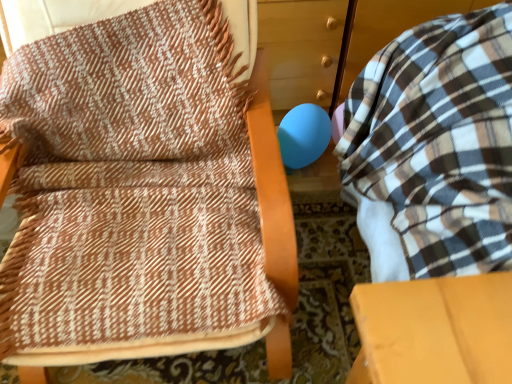
Question: Can you confirm if brown woven blanket at upper left is thinner than plaid fabric bean bag at right?

Choices:
 (A) no
 (B) yes

Answer: (B)

Question: Is brown woven blanket at upper left in contact with plaid fabric bean bag at right?

Choices:
 (A) yes
 (B) no

Answer: (B)

Question: Considering the relative sizes of brown woven blanket at upper left and plaid fabric bean bag at right in the image provided, is brown woven blanket at upper left smaller than plaid fabric bean bag at right?

Choices:
 (A) yes
 (B) no

Answer: (A)

Question: Can you confirm if brown woven blanket at upper left is wider than plaid fabric bean bag at right?

Choices:
 (A) no
 (B) yes

Answer: (A)

Question: Can you confirm if brown woven blanket at upper left is taller than plaid fabric bean bag at right?

Choices:
 (A) no
 (B) yes

Answer: (A)

Question: From the image's perspective, is plaid fabric bean bag at right located above or below matte blue balloon at center?

Choices:
 (A) above
 (B) below

Answer: (B)

Question: In terms of width, does plaid fabric bean bag at right look wider or thinner when compared to matte blue balloon at center?

Choices:
 (A) thin
 (B) wide

Answer: (B)

Question: From a real-world perspective, is plaid fabric bean bag at right positioned above or below matte blue balloon at center?

Choices:
 (A) above
 (B) below

Answer: (A)

Question: Based on their positions, is plaid fabric bean bag at right located to the left or right of matte blue balloon at center?

Choices:
 (A) right
 (B) left

Answer: (A)

Question: Is plaid fabric bean bag at right in front of or behind brown woven blanket at upper left in the image?

Choices:
 (A) front
 (B) behind

Answer: (A)

Question: From the image's perspective, relative to brown woven blanket at upper left, is plaid fabric bean bag at right above or below?

Choices:
 (A) below
 (B) above

Answer: (A)

Question: Is plaid fabric bean bag at right taller or shorter than brown woven blanket at upper left?

Choices:
 (A) short
 (B) tall

Answer: (B)

Question: Choose the correct answer: Is plaid fabric bean bag at right inside brown woven blanket at upper left or outside it?

Choices:
 (A) outside
 (B) inside

Answer: (A)

Question: Is matte blue balloon at center bigger or smaller than brown woven blanket at upper left?

Choices:
 (A) big
 (B) small

Answer: (B)

Question: Considering their positions, is matte blue balloon at center located in front of or behind brown woven blanket at upper left?

Choices:
 (A) behind
 (B) front

Answer: (A)